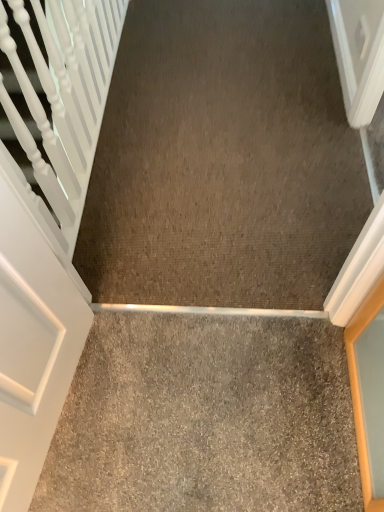
This screenshot has height=512, width=384. What do you see at coordinates (223, 160) in the screenshot? I see `brown carpet at center, marked as the 2th concrete in a bottom-to-top arrangement` at bounding box center [223, 160].

Where is `brown carpet at center, placed as the 2th concrete when sorted from front to back`? This screenshot has height=512, width=384. brown carpet at center, placed as the 2th concrete when sorted from front to back is located at coordinates (223, 160).

Describe the element at coordinates (205, 418) in the screenshot. I see `gray carpet at center, the 1th concrete when ordered from front to back` at that location.

This screenshot has height=512, width=384. I want to click on gray carpet at center, placed as the second concrete when sorted from top to bottom, so click(205, 418).

Where is `brown carpet at center, marked as the 2th concrete in a bottom-to-top arrangement`? The width and height of the screenshot is (384, 512). brown carpet at center, marked as the 2th concrete in a bottom-to-top arrangement is located at coordinates (223, 160).

In the scene shown: Considering the positions of objects gray carpet at center, the 1th concrete when ordered from front to back, and brown carpet at center, marked as the 2th concrete in a bottom-to-top arrangement, in the image provided, who is more to the right, gray carpet at center, the 1th concrete when ordered from front to back, or brown carpet at center, marked as the 2th concrete in a bottom-to-top arrangement,?

From the viewer's perspective, brown carpet at center, marked as the 2th concrete in a bottom-to-top arrangement, appears more on the right side.

Looking at this image, considering the relative positions of gray carpet at center, acting as the second concrete starting from the back, and brown carpet at center, marked as the 2th concrete in a bottom-to-top arrangement, in the image provided, is gray carpet at center, acting as the second concrete starting from the back, behind brown carpet at center, marked as the 2th concrete in a bottom-to-top arrangement,?

No, gray carpet at center, acting as the second concrete starting from the back, is in front of brown carpet at center, marked as the 2th concrete in a bottom-to-top arrangement.

Is point (69, 400) positioned behind point (314, 94)?

No, it is not.

From the image's perspective, would you say gray carpet at center, the 1th concrete when ordered from front to back, is shown under brown carpet at center, placed as the 2th concrete when sorted from front to back?

Correct, gray carpet at center, the 1th concrete when ordered from front to back, appears lower than brown carpet at center, placed as the 2th concrete when sorted from front to back, in the image.

From a real-world perspective, is gray carpet at center, acting as the second concrete starting from the back, on top of brown carpet at center, marked as the 2th concrete in a bottom-to-top arrangement?

Actually, gray carpet at center, acting as the second concrete starting from the back, is physically below brown carpet at center, marked as the 2th concrete in a bottom-to-top arrangement, in the real world.

Considering the sizes of objects gray carpet at center, placed as the second concrete when sorted from top to bottom, and brown carpet at center, the 1th concrete in the back-to-front sequence, in the image provided, who is wider, gray carpet at center, placed as the second concrete when sorted from top to bottom, or brown carpet at center, the 1th concrete in the back-to-front sequence,?

With larger width is brown carpet at center, the 1th concrete in the back-to-front sequence.

Based on the photo, can you confirm if gray carpet at center, acting as the second concrete starting from the back, is taller than brown carpet at center, placed as the 2th concrete when sorted from front to back?

No, gray carpet at center, acting as the second concrete starting from the back, is not taller than brown carpet at center, placed as the 2th concrete when sorted from front to back.

Consider the image. Can you confirm if gray carpet at center, placed as the second concrete when sorted from top to bottom, is smaller than brown carpet at center, placed as the 2th concrete when sorted from front to back?

Yes.

From the picture: Do you think gray carpet at center, placed as the second concrete when sorted from top to bottom, is within brown carpet at center, placed as the first concrete when sorted from top to bottom, or outside of it?

gray carpet at center, placed as the second concrete when sorted from top to bottom, is not enclosed by brown carpet at center, placed as the first concrete when sorted from top to bottom.

Is gray carpet at center, the 1th concrete when ordered from front to back, in contact with brown carpet at center, placed as the 2th concrete when sorted from front to back?

No, gray carpet at center, the 1th concrete when ordered from front to back, is not with brown carpet at center, placed as the 2th concrete when sorted from front to back.

Is gray carpet at center, acting as the second concrete starting from the back, facing away from brown carpet at center, placed as the first concrete when sorted from top to bottom?

That's not correct — gray carpet at center, acting as the second concrete starting from the back, is not looking away from brown carpet at center, placed as the first concrete when sorted from top to bottom.

How different are the orientations of gray carpet at center, placed as the second concrete when sorted from top to bottom, and brown carpet at center, placed as the 2th concrete when sorted from front to back, in degrees?

The angle between the facing direction of gray carpet at center, placed as the second concrete when sorted from top to bottom, and the facing direction of brown carpet at center, placed as the 2th concrete when sorted from front to back, is 180 degrees.

Measure the distance between gray carpet at center, positioned as the first concrete in bottom-to-top order, and brown carpet at center, the 1th concrete in the back-to-front sequence.

gray carpet at center, positioned as the first concrete in bottom-to-top order, and brown carpet at center, the 1th concrete in the back-to-front sequence, are 23.90 inches apart.

Identify the location of concrete that appears on the left of brown carpet at center, placed as the 2th concrete when sorted from front to back. The height and width of the screenshot is (512, 384). (205, 418).

Considering the relative positions of brown carpet at center, the 1th concrete in the back-to-front sequence, and gray carpet at center, the 1th concrete when ordered from front to back, in the image provided, is brown carpet at center, the 1th concrete in the back-to-front sequence, to the left of gray carpet at center, the 1th concrete when ordered from front to back, from the viewer's perspective?

Incorrect, brown carpet at center, the 1th concrete in the back-to-front sequence, is not on the left side of gray carpet at center, the 1th concrete when ordered from front to back.

Which object is more forward, brown carpet at center, placed as the 2th concrete when sorted from front to back, or gray carpet at center, acting as the second concrete starting from the back?

Positioned in front is gray carpet at center, acting as the second concrete starting from the back.

Which is nearer, (140, 108) or (242, 388)?

The point (242, 388) is in front.

In the scene shown: From the image's perspective, would you say brown carpet at center, placed as the first concrete when sorted from top to bottom, is shown under gray carpet at center, the 1th concrete when ordered from front to back?

No, from the image's perspective, brown carpet at center, placed as the first concrete when sorted from top to bottom, is not beneath gray carpet at center, the 1th concrete when ordered from front to back.

From a real-world perspective, which object stands above the other?

brown carpet at center, placed as the first concrete when sorted from top to bottom.

Does brown carpet at center, placed as the 2th concrete when sorted from front to back, have a greater width compared to gray carpet at center, the 1th concrete when ordered from front to back?

Yes.

Between brown carpet at center, the 1th concrete in the back-to-front sequence, and gray carpet at center, acting as the second concrete starting from the back, which one has more height?

With more height is brown carpet at center, the 1th concrete in the back-to-front sequence.

Can you confirm if brown carpet at center, the 1th concrete in the back-to-front sequence, is smaller than gray carpet at center, placed as the second concrete when sorted from top to bottom?

No, brown carpet at center, the 1th concrete in the back-to-front sequence, is not smaller than gray carpet at center, placed as the second concrete when sorted from top to bottom.

Choose the correct answer: Is brown carpet at center, placed as the first concrete when sorted from top to bottom, inside gray carpet at center, acting as the second concrete starting from the back, or outside it?

brown carpet at center, placed as the first concrete when sorted from top to bottom, is located beyond the bounds of gray carpet at center, acting as the second concrete starting from the back.

Is brown carpet at center, marked as the 2th concrete in a bottom-to-top arrangement, touching gray carpet at center, acting as the second concrete starting from the back?

No, brown carpet at center, marked as the 2th concrete in a bottom-to-top arrangement, is not touching gray carpet at center, acting as the second concrete starting from the back.

Is brown carpet at center, marked as the 2th concrete in a bottom-to-top arrangement, looking in the opposite direction of gray carpet at center, placed as the second concrete when sorted from top to bottom?

brown carpet at center, marked as the 2th concrete in a bottom-to-top arrangement, is not turned away from gray carpet at center, placed as the second concrete when sorted from top to bottom.

Can you tell me how much brown carpet at center, marked as the 2th concrete in a bottom-to-top arrangement, and gray carpet at center, positioned as the first concrete in bottom-to-top order, differ in facing direction?

180 degrees.

At what (x,y) coordinates should I click in order to perform the action: click on concrete above the gray carpet at center, positioned as the first concrete in bottom-to-top order (from the image's perspective). Please return your answer as a coordinate pair (x, y). Looking at the image, I should click on (223, 160).

Find the location of a particular element. The image size is (384, 512). concrete below the brown carpet at center, the 1th concrete in the back-to-front sequence (from the image's perspective) is located at coordinates (205, 418).

The width and height of the screenshot is (384, 512). Find the location of `concrete above the gray carpet at center, acting as the second concrete starting from the back (from the image's perspective)`. concrete above the gray carpet at center, acting as the second concrete starting from the back (from the image's perspective) is located at coordinates (223, 160).